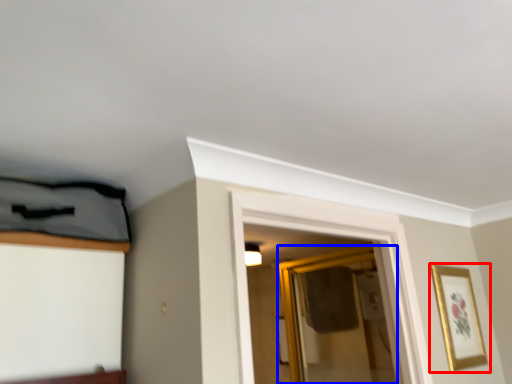
Question: Which object appears closest to the camera in this image, picture frame (highlighted by a red box) or glass door (highlighted by a blue box)?

Choices:
 (A) picture frame
 (B) glass door

Answer: (A)